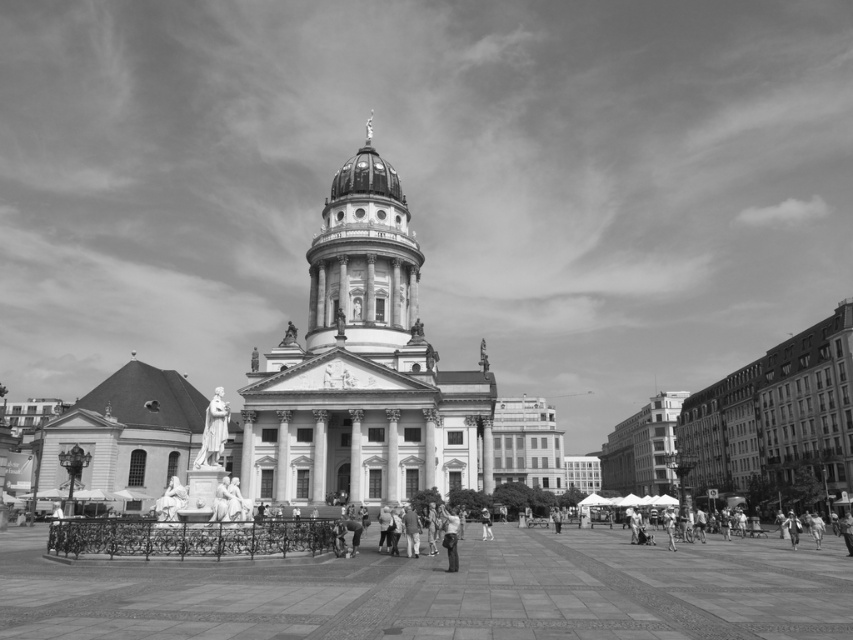
Can you confirm if white stone church at lower left is wider than white marble statue at center?

Indeed, white stone church at lower left has a greater width compared to white marble statue at center.

Can you confirm if white stone church at lower left is thinner than white marble statue at center?

In fact, white stone church at lower left might be wider than white marble statue at center.

Between point (109, 452) and point (196, 452), which one is positioned behind?

Positioned behind is point (196, 452).

You are a GUI agent. You are given a task and a screenshot of the screen. Output one action in this format:
    pyautogui.click(x=<x>, y=<y>)
    Task: Click on the white stone church at lower left
    Image resolution: width=853 pixels, height=640 pixels.
    Given the screenshot: What is the action you would take?
    pyautogui.click(x=125, y=436)

Can you confirm if white marble church at center is bigger than smooth stone column at center?

Yes.

Does white marble church at center come in front of smooth stone column at center?

Yes, white marble church at center is in front of smooth stone column at center.

I want to click on white marble church at center, so click(x=366, y=364).

Where is `white marble church at center`? This screenshot has height=640, width=853. white marble church at center is located at coordinates (366, 364).

Does white marble church at center have a lesser height compared to light skin tone human at center?

No.

Is white marble church at center bigger than light skin tone human at center?

Yes, white marble church at center is bigger than light skin tone human at center.

Locate an element on the screen. Image resolution: width=853 pixels, height=640 pixels. white marble church at center is located at coordinates (366, 364).

I want to click on white marble church at center, so click(366, 364).